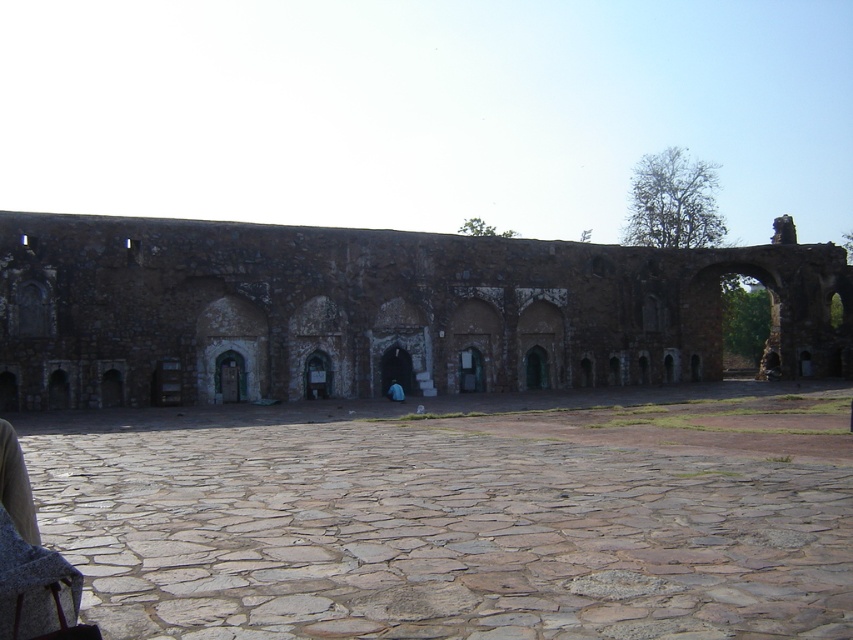
Does stone paved courtyard at center have a greater width compared to rustic stone wall at center?

No, stone paved courtyard at center is not wider than rustic stone wall at center.

This screenshot has height=640, width=853. Describe the element at coordinates (459, 515) in the screenshot. I see `stone paved courtyard at center` at that location.

Between point (477, 525) and point (608, 349), which one is positioned behind?

The point (608, 349) is behind.

Where is `stone paved courtyard at center`? stone paved courtyard at center is located at coordinates pyautogui.click(x=459, y=515).